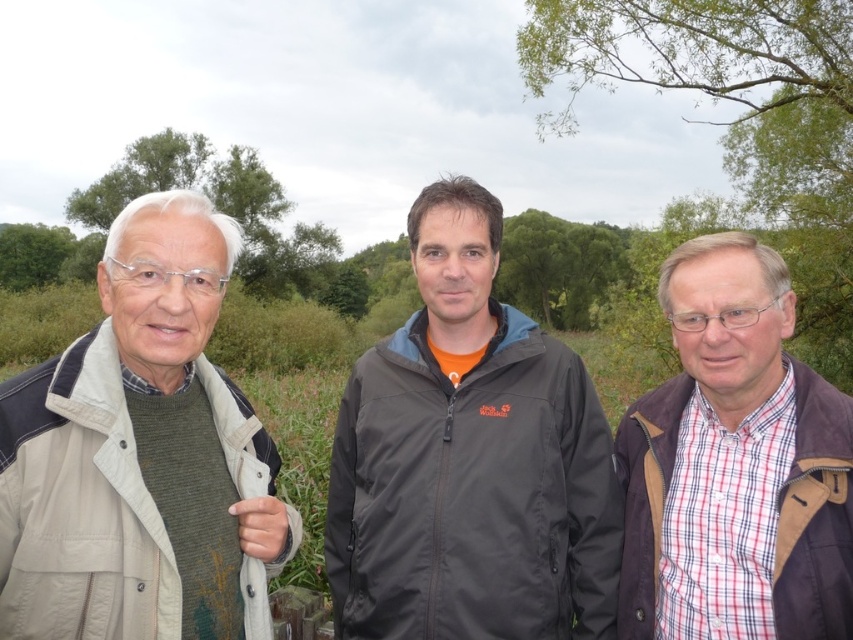
You are a photographer trying to capture a clear shot of the dark gray jacket at center without any obstructions. Given the current positioning, will the green leafy tree at left block the view of the jacket?

The dark gray jacket at center is in front of the green leafy tree at left, so the tree will not block the view of the jacket since it is behind the jacket.

You are standing in a park and see the dark gray jacket at center. If you want to reach it in 2 seconds, what is the minimum speed you need to move at?

The dark gray jacket at center is 8.07 feet away. To reach it in 2 seconds, you would need to move at a minimum speed of 4.035 feet per second.